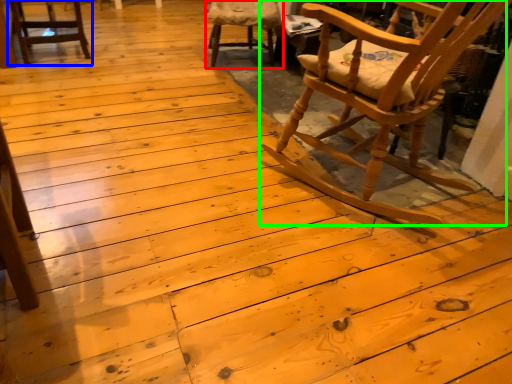
Question: Which object is positioned closest to chair (highlighted by a red box)? Select from chair (highlighted by a blue box) and chair (highlighted by a green box).

Choices:
 (A) chair
 (B) chair

Answer: (A)